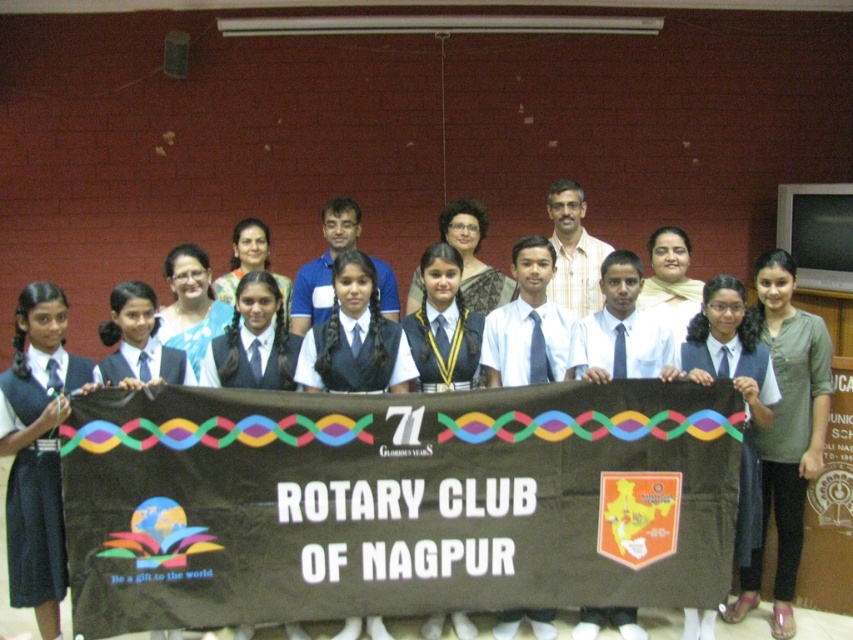
Which of these two, brown fabric banner at center or green fabric dress at center, stands taller?

green fabric dress at center is taller.

Is brown fabric banner at center shorter than green fabric dress at center?

Yes.

Between point (273, 506) and point (746, 589), which one is positioned behind?

The point (746, 589) is behind.

Locate an element on the screen. The height and width of the screenshot is (640, 853). brown fabric banner at center is located at coordinates (395, 502).

Is point (128, 436) farther from viewer compared to point (90, 376)?

That is False.

Between matte black tie at center and matte black tie at left, which one appears on the left side from the viewer's perspective?

matte black tie at left

Does point (422, 508) come behind point (19, 588)?

Yes, it is behind point (19, 588).

Find the location of a particular element. This screenshot has width=853, height=640. matte black tie at center is located at coordinates (395, 502).

Does brown fabric banner at center have a smaller size compared to matte black tie at left?

No, brown fabric banner at center is not smaller than matte black tie at left.

Is point (699, 545) in front of point (32, 467)?

No, it is behind (32, 467).

I want to click on brown fabric banner at center, so click(395, 502).